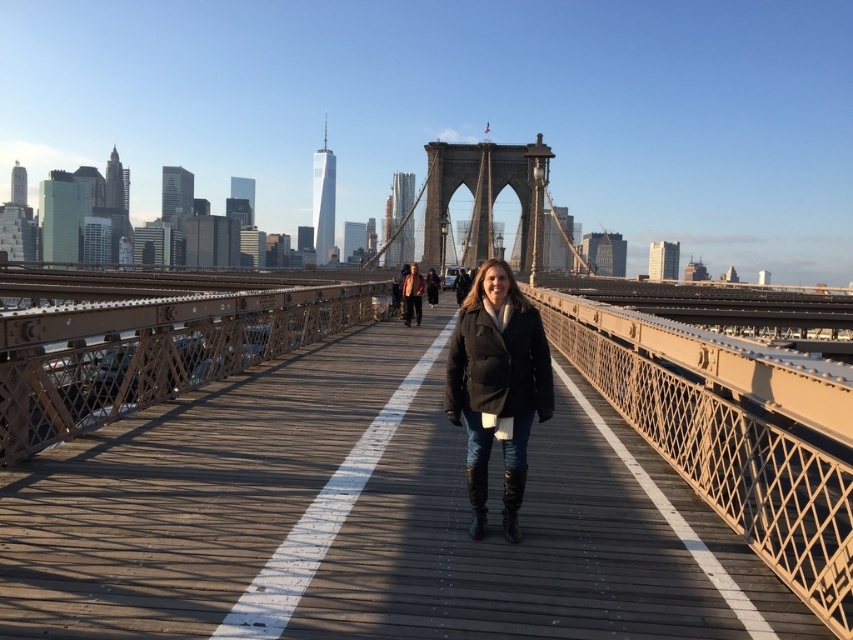
Does black leather jacket at center have a larger size compared to matte brown jacket at center?

Yes, black leather jacket at center is bigger than matte brown jacket at center.

Based on the photo, is black leather jacket at center closer to the viewer compared to matte brown jacket at center?

That is True.

Is point (544, 397) positioned before point (419, 323)?

Yes, point (544, 397) is closer to viewer.

You are a GUI agent. You are given a task and a screenshot of the screen. Output one action in this format:
    pyautogui.click(x=<x>, y=<y>)
    Task: Click on the black leather jacket at center
    This screenshot has height=640, width=853.
    Given the screenshot: What is the action you would take?
    pyautogui.click(x=497, y=385)

Describe the element at coordinates (497, 385) in the screenshot. I see `black leather jacket at center` at that location.

Can you confirm if black leather jacket at center is positioned below leather at center?

Incorrect, black leather jacket at center is not positioned below leather at center.

Who is more forward, (x=509, y=291) or (x=479, y=474)?

Point (x=479, y=474) is more forward.

Where is `black leather jacket at center`? The height and width of the screenshot is (640, 853). black leather jacket at center is located at coordinates (497, 385).

Is point (514, 502) in front of point (474, 509)?

That is True.

Is leather boots at center bigger than leather at center?

Yes.

Image resolution: width=853 pixels, height=640 pixels. What do you see at coordinates (512, 500) in the screenshot?
I see `leather boots at center` at bounding box center [512, 500].

At what (x,y) coordinates should I click in order to perform the action: click on leather boots at center. Please return your answer as a coordinate pair (x, y). The image size is (853, 640). Looking at the image, I should click on (512, 500).